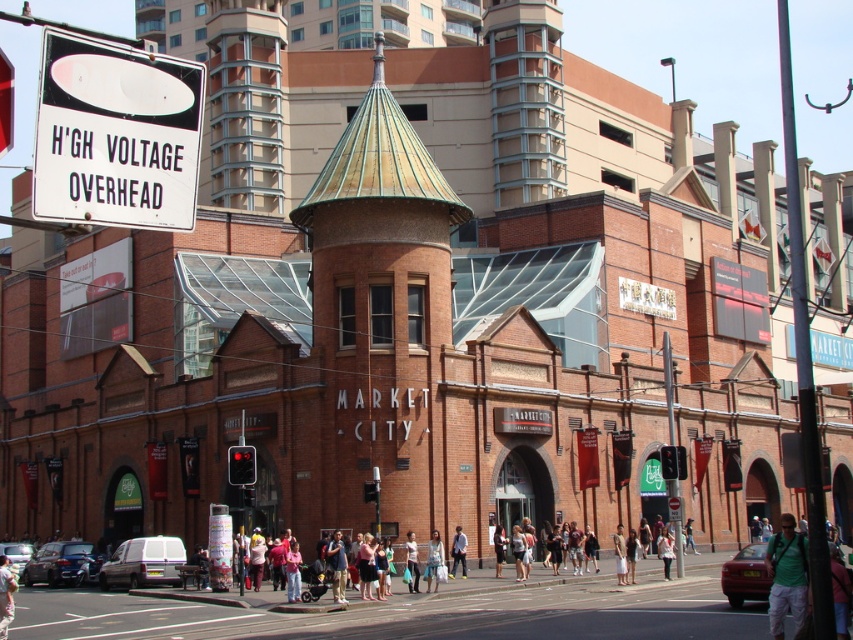
Question: Can you confirm if green fabric backpack at lower right is thinner than light blue jeans at center?

Choices:
 (A) no
 (B) yes

Answer: (A)

Question: Based on their relative distances, which object is farther from the brick tower at center?

Choices:
 (A) light blue denim jeans at center
 (B) light brown leather jacket at center
 (C) light beige pants at lower left

Answer: (C)

Question: Among these points, which one is nearest to the camera?

Choices:
 (A) (772, 579)
 (B) (306, 192)

Answer: (A)

Question: Can you confirm if brick tower at center is positioned to the left of green fabric backpack at lower right?

Choices:
 (A) yes
 (B) no

Answer: (A)

Question: Can you confirm if white plastic sign at upper left is thinner than light brown leather jacket at center?

Choices:
 (A) yes
 (B) no

Answer: (A)

Question: Which object is closer to the camera taking this photo?

Choices:
 (A) green fabric backpack at lower right
 (B) brick tower at center
 (C) light blue denim jeans at center

Answer: (A)